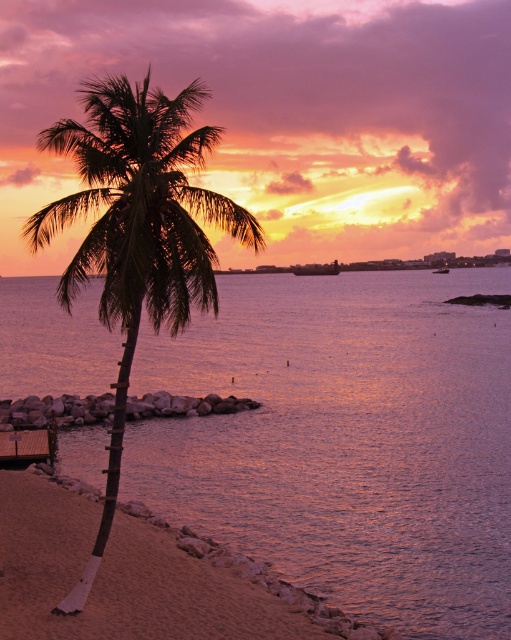
Can you confirm if green leafy palm tree at left is bigger than sandy beach at lower left?

Yes, green leafy palm tree at left is bigger than sandy beach at lower left.

Is green leafy palm tree at left shorter than sandy beach at lower left?

Incorrect, green leafy palm tree at left's height does not fall short of sandy beach at lower left's.

From the picture: Measure the distance between point (195, 253) and camera.

Point (195, 253) and camera are 32.31 feet apart from each other.

In order to click on green leafy palm tree at left in this screenshot , I will do `click(136, 230)`.

Is purple reflective water at center taller than green leafy palm tree at left?

In fact, purple reflective water at center may be shorter than green leafy palm tree at left.

At what (x,y) coordinates should I click in order to perform the action: click on purple reflective water at center. Please return your answer as a coordinate pair (x, y). This screenshot has width=511, height=640. Looking at the image, I should click on (345, 440).

The image size is (511, 640). What do you see at coordinates (345, 440) in the screenshot? I see `purple reflective water at center` at bounding box center [345, 440].

Between point (364, 304) and point (16, 602), which one is positioned in front?

Point (16, 602) is more forward.

This screenshot has height=640, width=511. I want to click on purple reflective water at center, so click(x=345, y=440).

At what (x,y) coordinates should I click in order to perform the action: click on purple reflective water at center. Please return your answer as a coordinate pair (x, y). Looking at the image, I should click on (345, 440).